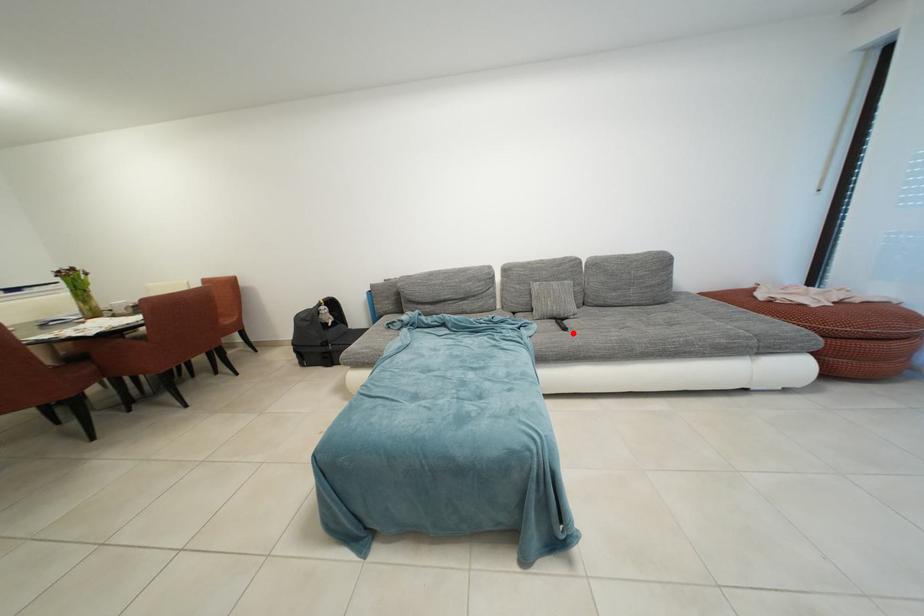
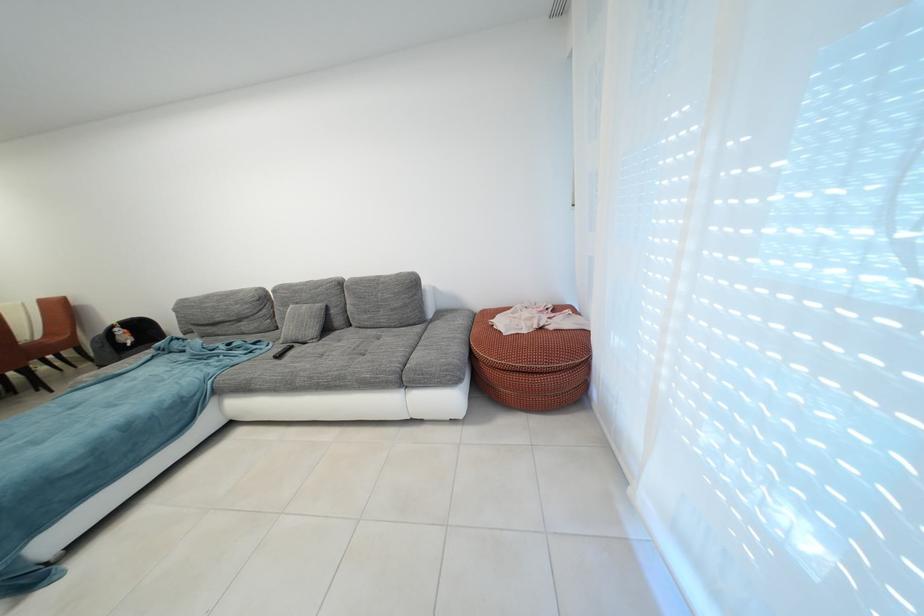
The point at the highlighted location is marked in the first image. Where is the corresponding point in the second image?

(287, 361)